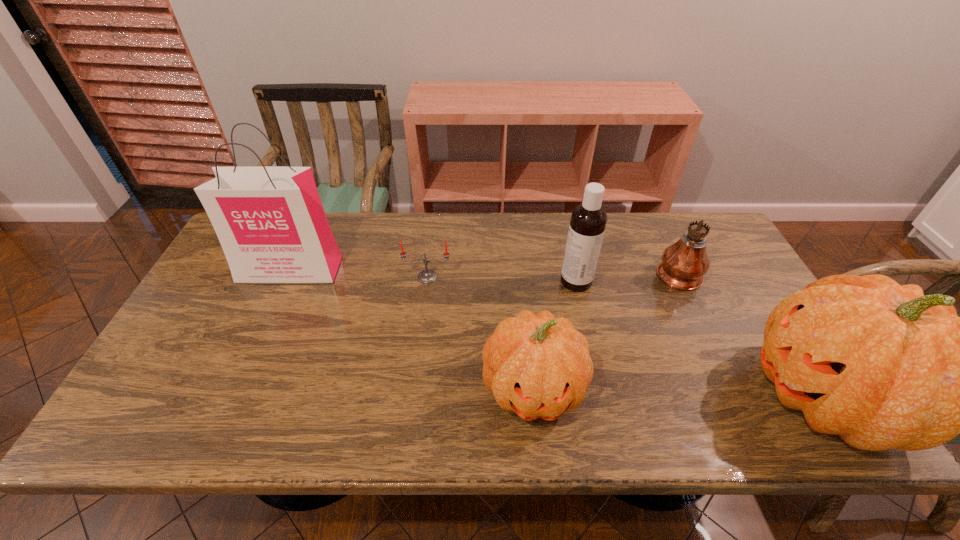
Find the location of a particular element. the left pumpkin is located at coordinates (538, 366).

At what (x,y) coordinates should I click in order to perform the action: click on the shorter pumpkin. Please return your answer as a coordinate pair (x, y). The width and height of the screenshot is (960, 540). Looking at the image, I should click on (538, 366).

I want to click on oil lamp, so click(684, 263).

This screenshot has width=960, height=540. I want to click on the leftmost object, so click(270, 222).

Where is `shopping bag`? shopping bag is located at coordinates (270, 222).

This screenshot has width=960, height=540. I want to click on the fifth object from right to left, so click(x=426, y=276).

You are a GUI agent. You are given a task and a screenshot of the screen. Output one action in this format:
    pyautogui.click(x=<x>, y=<y>)
    Task: Click on the candle
    This screenshot has width=960, height=540.
    Given the screenshot: What is the action you would take?
    pyautogui.click(x=426, y=276)

Where is `dishwasher detergent`? dishwasher detergent is located at coordinates (588, 221).

Find the location of a particular element. Image resolution: width=960 pixels, height=540 pixels. vacant area situated 0.110m on the right of the oil lamp is located at coordinates (736, 272).

Locate an element on the screen. vacant space situated on the front-facing side of the leftmost object is located at coordinates (231, 400).